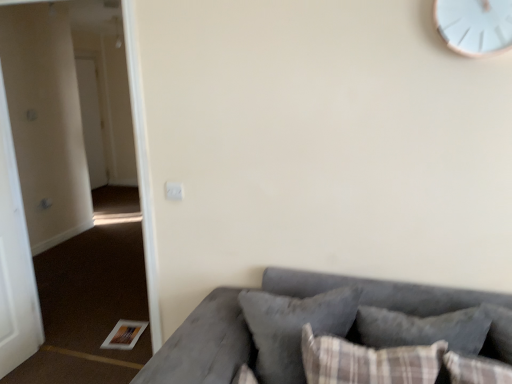
Question: Is white matte door at left, placed as the second door when sorted from back to front, shorter than brown carpet at lower left?

Choices:
 (A) yes
 (B) no

Answer: (A)

Question: Considering the relative sizes of white matte door at left, the 1th door in the front-to-back sequence, and brown carpet at lower left in the image provided, is white matte door at left, the 1th door in the front-to-back sequence, thinner than brown carpet at lower left?

Choices:
 (A) no
 (B) yes

Answer: (A)

Question: From a real-world perspective, does white matte door at left, the 1th door viewed from the right, sit lower than brown carpet at lower left?

Choices:
 (A) yes
 (B) no

Answer: (A)

Question: Can you see white matte door at left, the 1th door viewed from the right, touching brown carpet at lower left?

Choices:
 (A) yes
 (B) no

Answer: (B)

Question: Does white matte door at left, placed as the second door when sorted from back to front, come in front of brown carpet at lower left?

Choices:
 (A) no
 (B) yes

Answer: (A)

Question: From a real-world perspective, is brown carpet at lower left above or below plaid fabric pillow at lower right, the 2th pillow in the back-to-front sequence?

Choices:
 (A) below
 (B) above

Answer: (B)

Question: Relative to plaid fabric pillow at lower right, the first pillow from the front, is brown carpet at lower left in front or behind?

Choices:
 (A) front
 (B) behind

Answer: (B)

Question: From the image's perspective, is brown carpet at lower left above or below plaid fabric pillow at lower right, the 2th pillow in the back-to-front sequence?

Choices:
 (A) below
 (B) above

Answer: (B)

Question: In the image, is brown carpet at lower left on the left side or the right side of plaid fabric pillow at lower right, the 2th pillow in the back-to-front sequence?

Choices:
 (A) left
 (B) right

Answer: (A)

Question: Considering the positions of white matte door at left, which is the second door from left to right, and velvet gray pillow at lower center, marked as the 1th pillow in a back-to-front arrangement, in the image, is white matte door at left, which is the second door from left to right, taller or shorter than velvet gray pillow at lower center, marked as the 1th pillow in a back-to-front arrangement,?

Choices:
 (A) short
 (B) tall

Answer: (B)

Question: Is point (12, 187) closer or farther from the camera than point (331, 304)?

Choices:
 (A) farther
 (B) closer

Answer: (A)

Question: From the image's perspective, is white matte door at left, which is the second door from left to right, positioned above or below velvet gray pillow at lower center, marked as the 1th pillow in a back-to-front arrangement?

Choices:
 (A) above
 (B) below

Answer: (A)

Question: Considering the positions of white matte door at left, the 1th door in the front-to-back sequence, and velvet gray pillow at lower center, marked as the 1th pillow in a back-to-front arrangement, in the image, is white matte door at left, the 1th door in the front-to-back sequence, bigger or smaller than velvet gray pillow at lower center, marked as the 1th pillow in a back-to-front arrangement,?

Choices:
 (A) small
 (B) big

Answer: (B)

Question: Is white glossy door at left, positioned as the second door in right-to-left order, in front of or behind white matte door at left, placed as the second door when sorted from back to front, in the image?

Choices:
 (A) behind
 (B) front

Answer: (A)

Question: Is white glossy door at left, positioned as the second door in right-to-left order, inside the boundaries of white matte door at left, placed as the second door when sorted from back to front, or outside?

Choices:
 (A) outside
 (B) inside

Answer: (A)